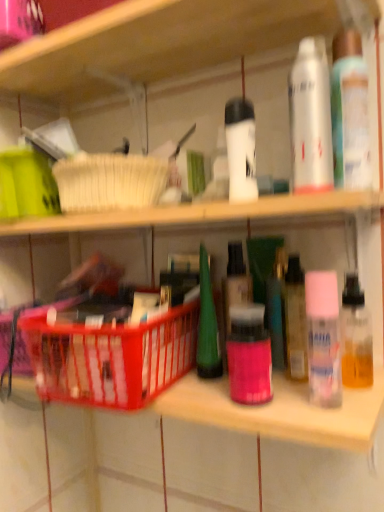
Based on the photo, measure the distance between translucent plastic basket at center and camera.

translucent plastic basket at center is 19.90 inches from camera.

You are a GUI agent. You are given a task and a screenshot of the screen. Output one action in this format:
    pyautogui.click(x=<x>, y=<y>)
    Task: Click on the translucent plastic spray can at upper right, which is the fourth toiletry in bottom-to-top order
    
    Given the screenshot: What is the action you would take?
    pyautogui.click(x=350, y=113)

Locate an element on the screen. pink matte bottle at center, positioned as the 4th toiletry in top-to-bottom order is located at coordinates (249, 355).

Locate an element on the screen. Image resolution: width=384 pixels, height=512 pixels. translucent plastic basket at center is located at coordinates (112, 358).

Which object is further away from the camera, translucent plastic spray can at upper right, which is the fourth toiletry in bottom-to-top order, or pink matte bottle at center, arranged as the 1th toiletry when ordered from the bottom?

pink matte bottle at center, arranged as the 1th toiletry when ordered from the bottom.

Considering the sizes of objects translucent plastic spray can at upper right, placed as the 1th toiletry when sorted from top to bottom, and pink matte bottle at center, positioned as the 4th toiletry in top-to-bottom order, in the image provided, who is bigger, translucent plastic spray can at upper right, placed as the 1th toiletry when sorted from top to bottom, or pink matte bottle at center, positioned as the 4th toiletry in top-to-bottom order,?

Bigger between the two is translucent plastic spray can at upper right, placed as the 1th toiletry when sorted from top to bottom.

From a real-world perspective, who is located higher, translucent plastic spray can at upper right, placed as the 1th toiletry when sorted from top to bottom, or pink matte bottle at center, positioned as the 4th toiletry in top-to-bottom order?

From a 3D spatial view, translucent plastic spray can at upper right, placed as the 1th toiletry when sorted from top to bottom, is above.

How many degrees apart are the facing directions of translucent plastic spray can at upper right, placed as the 1th toiletry when sorted from top to bottom, and pink matte bottle at center, arranged as the 1th toiletry when ordered from the bottom?

They differ by 0.000985 degrees in their facing directions.

From the image's perspective, which one is positioned lower, translucent plastic basket at center or translucent plastic spray can at upper right, placed as the 1th toiletry when sorted from top to bottom?

translucent plastic basket at center appears lower in the image.

Consider the image. Considering the positions of objects translucent plastic basket at center and translucent plastic spray can at upper right, which is the fourth toiletry in bottom-to-top order, in the image provided, who is more to the right, translucent plastic basket at center or translucent plastic spray can at upper right, which is the fourth toiletry in bottom-to-top order,?

Positioned to the right is translucent plastic spray can at upper right, which is the fourth toiletry in bottom-to-top order.

Can you confirm if translucent plastic basket at center is taller than translucent plastic spray can at upper right, placed as the 1th toiletry when sorted from top to bottom?

In fact, translucent plastic basket at center may be shorter than translucent plastic spray can at upper right, placed as the 1th toiletry when sorted from top to bottom.

Is pink matte bottle at center, positioned as the 4th toiletry in top-to-bottom order, inside translucent plastic basket at center?

That's incorrect, pink matte bottle at center, positioned as the 4th toiletry in top-to-bottom order, is not inside translucent plastic basket at center.

From the image's perspective, does translucent plastic basket at center appear higher than pink matte bottle at center, arranged as the 1th toiletry when ordered from the bottom?

Yes, from the image's perspective, translucent plastic basket at center is on top of pink matte bottle at center, arranged as the 1th toiletry when ordered from the bottom.

Considering the sizes of objects translucent plastic basket at center and pink matte bottle at center, positioned as the 4th toiletry in top-to-bottom order, in the image provided, who is smaller, translucent plastic basket at center or pink matte bottle at center, positioned as the 4th toiletry in top-to-bottom order,?

With smaller size is pink matte bottle at center, positioned as the 4th toiletry in top-to-bottom order.

How much distance is there between translucent plastic basket at center and pink matte bottle at center, arranged as the 1th toiletry when ordered from the bottom?

translucent plastic basket at center is 5.26 inches away from pink matte bottle at center, arranged as the 1th toiletry when ordered from the bottom.

The width and height of the screenshot is (384, 512). I want to click on the 1st toiletry located beneath the white matte spray can at upper center, acting as the third toiletry starting from the bottom (from a real-world perspective), so click(x=323, y=338).

Can you see white matte spray can at upper center, which appears as the second toiletry when viewed from the top, touching pink matte spray can at right, acting as the 2th toiletry starting from the bottom?

No, white matte spray can at upper center, which appears as the second toiletry when viewed from the top, is not making contact with pink matte spray can at right, acting as the 2th toiletry starting from the bottom.

From the image's perspective, is white matte spray can at upper center, which appears as the second toiletry when viewed from the top, above or below pink matte spray can at right, acting as the 2th toiletry starting from the bottom?

From the image's perspective, white matte spray can at upper center, which appears as the second toiletry when viewed from the top, appears above pink matte spray can at right, acting as the 2th toiletry starting from the bottom.

In the scene shown: Would you say white matte spray can at upper right is outside white matte spray can at upper center, which appears as the second toiletry when viewed from the top?

Yes, white matte spray can at upper right is located beyond the bounds of white matte spray can at upper center, which appears as the second toiletry when viewed from the top.

Can you confirm if white matte spray can at upper right is positioned to the right of white matte spray can at upper center, acting as the third toiletry starting from the bottom?

Correct, you'll find white matte spray can at upper right to the right of white matte spray can at upper center, acting as the third toiletry starting from the bottom.

Considering the relative sizes of white matte spray can at upper right and white matte spray can at upper center, acting as the third toiletry starting from the bottom, in the image provided, is white matte spray can at upper right wider than white matte spray can at upper center, acting as the third toiletry starting from the bottom,?

Yes, white matte spray can at upper right is wider than white matte spray can at upper center, acting as the third toiletry starting from the bottom.

From a real-world perspective, is white matte spray can at upper right positioned above or below white matte spray can at upper center, acting as the third toiletry starting from the bottom?

white matte spray can at upper right is situated higher than white matte spray can at upper center, acting as the third toiletry starting from the bottom, in the real world.

Could you tell me if pink matte bottle at center, positioned as the 4th toiletry in top-to-bottom order, is turned towards translucent plastic spray can at upper right, which is the fourth toiletry in bottom-to-top order?

No, pink matte bottle at center, positioned as the 4th toiletry in top-to-bottom order, is not aimed at translucent plastic spray can at upper right, which is the fourth toiletry in bottom-to-top order.

Can translucent plastic spray can at upper right, which is the fourth toiletry in bottom-to-top order, be found inside pink matte bottle at center, arranged as the 1th toiletry when ordered from the bottom?

No.

Considering the relative positions of pink matte bottle at center, arranged as the 1th toiletry when ordered from the bottom, and translucent plastic spray can at upper right, which is the fourth toiletry in bottom-to-top order, in the image provided, is pink matte bottle at center, arranged as the 1th toiletry when ordered from the bottom, in front of translucent plastic spray can at upper right, which is the fourth toiletry in bottom-to-top order,?

No, it is not.

Which object is positioned more to the right, pink matte bottle at center, positioned as the 4th toiletry in top-to-bottom order, or translucent plastic spray can at upper right, placed as the 1th toiletry when sorted from top to bottom?

Positioned to the right is translucent plastic spray can at upper right, placed as the 1th toiletry when sorted from top to bottom.

Considering the relative positions of translucent plastic spray can at upper right, placed as the 1th toiletry when sorted from top to bottom, and white matte spray can at upper center, which appears as the second toiletry when viewed from the top, in the image provided, is translucent plastic spray can at upper right, placed as the 1th toiletry when sorted from top to bottom, to the left of white matte spray can at upper center, which appears as the second toiletry when viewed from the top, from the viewer's perspective?

No, translucent plastic spray can at upper right, placed as the 1th toiletry when sorted from top to bottom, is not to the left of white matte spray can at upper center, which appears as the second toiletry when viewed from the top.

How many degrees apart are the facing directions of translucent plastic spray can at upper right, placed as the 1th toiletry when sorted from top to bottom, and white matte spray can at upper center, acting as the third toiletry starting from the bottom?

There is a 4.95e-05-degree angle between the facing directions of translucent plastic spray can at upper right, placed as the 1th toiletry when sorted from top to bottom, and white matte spray can at upper center, acting as the third toiletry starting from the bottom.

Are translucent plastic spray can at upper right, which is the fourth toiletry in bottom-to-top order, and white matte spray can at upper center, which appears as the second toiletry when viewed from the top, located far from each other?

translucent plastic spray can at upper right, which is the fourth toiletry in bottom-to-top order, is near white matte spray can at upper center, which appears as the second toiletry when viewed from the top, not far away.

The image size is (384, 512). Identify the location of toiletry that is the 3rd one when counting downward from the translucent plastic spray can at upper right, which is the fourth toiletry in bottom-to-top order (from the image's perspective). (249, 355).

Where is `the 2nd toiletry in front when counting from the translucent plastic basket at center`? the 2nd toiletry in front when counting from the translucent plastic basket at center is located at coordinates pyautogui.click(x=350, y=113).

From the image, which object appears to be nearer to translucent plastic basket at center, pink matte bottle at center, arranged as the 1th toiletry when ordered from the bottom, or pink matte spray can at right, acting as the 2th toiletry starting from the bottom?

The object closer to translucent plastic basket at center is pink matte bottle at center, arranged as the 1th toiletry when ordered from the bottom.

Looking at the image, which one is located further to translucent plastic basket at center, white matte spray can at upper center, acting as the third toiletry starting from the bottom, or pink matte bottle at center, arranged as the 1th toiletry when ordered from the bottom?

white matte spray can at upper center, acting as the third toiletry starting from the bottom, lies further to translucent plastic basket at center than the other object.

Which object lies further to the anchor point pink matte bottle at center, arranged as the 1th toiletry when ordered from the bottom, white matte spray can at upper center, which appears as the second toiletry when viewed from the top, or translucent plastic spray can at upper right, placed as the 1th toiletry when sorted from top to bottom?

translucent plastic spray can at upper right, placed as the 1th toiletry when sorted from top to bottom, is further to pink matte bottle at center, arranged as the 1th toiletry when ordered from the bottom.

Looking at the image, which one is located further to translucent plastic spray can at upper right, placed as the 1th toiletry when sorted from top to bottom, pink matte bottle at center, arranged as the 1th toiletry when ordered from the bottom, or white matte spray can at upper right?

pink matte bottle at center, arranged as the 1th toiletry when ordered from the bottom.

Considering their positions, is pink matte bottle at center, arranged as the 1th toiletry when ordered from the bottom, positioned closer to white matte spray can at upper center, acting as the third toiletry starting from the bottom, than pink matte spray can at right, acting as the 3th toiletry starting from the top?

The object closer to white matte spray can at upper center, acting as the third toiletry starting from the bottom, is pink matte spray can at right, acting as the 3th toiletry starting from the top.

Estimate the real-world distances between objects in this image. Which object is further from white matte spray can at upper center, acting as the third toiletry starting from the bottom, white matte spray can at upper right or pink matte spray can at right, acting as the 2th toiletry starting from the bottom?

The object further to white matte spray can at upper center, acting as the third toiletry starting from the bottom, is pink matte spray can at right, acting as the 2th toiletry starting from the bottom.

Estimate the real-world distances between objects in this image. Which object is further from white matte spray can at upper right, white matte spray can at upper center, acting as the third toiletry starting from the bottom, or pink matte spray can at right, acting as the 3th toiletry starting from the top?

pink matte spray can at right, acting as the 3th toiletry starting from the top, is positioned further to the anchor white matte spray can at upper right.

When comparing their distances from white matte spray can at upper center, which appears as the second toiletry when viewed from the top, does pink matte bottle at center, positioned as the 4th toiletry in top-to-bottom order, or translucent plastic spray can at upper right, placed as the 1th toiletry when sorted from top to bottom, seem further?

pink matte bottle at center, positioned as the 4th toiletry in top-to-bottom order, is further to white matte spray can at upper center, which appears as the second toiletry when viewed from the top.

Image resolution: width=384 pixels, height=512 pixels. I want to click on basket between white matte spray can at upper center, which appears as the second toiletry when viewed from the top, and pink matte bottle at center, arranged as the 1th toiletry when ordered from the bottom, in the up-down direction, so click(x=112, y=358).

Locate an element on the screen. basket between white matte spray can at upper right and pink matte spray can at right, acting as the 3th toiletry starting from the top, from top to bottom is located at coordinates (112, 358).

Identify the location of toiletry between translucent plastic spray can at upper right, placed as the 1th toiletry when sorted from top to bottom, and translucent plastic basket at center, in the vertical direction. Image resolution: width=384 pixels, height=512 pixels. (241, 147).

Where is `mouthwash between translucent plastic spray can at upper right, placed as the 1th toiletry when sorted from top to bottom, and translucent plastic basket at center vertically`? The height and width of the screenshot is (512, 384). mouthwash between translucent plastic spray can at upper right, placed as the 1th toiletry when sorted from top to bottom, and translucent plastic basket at center vertically is located at coordinates (310, 118).